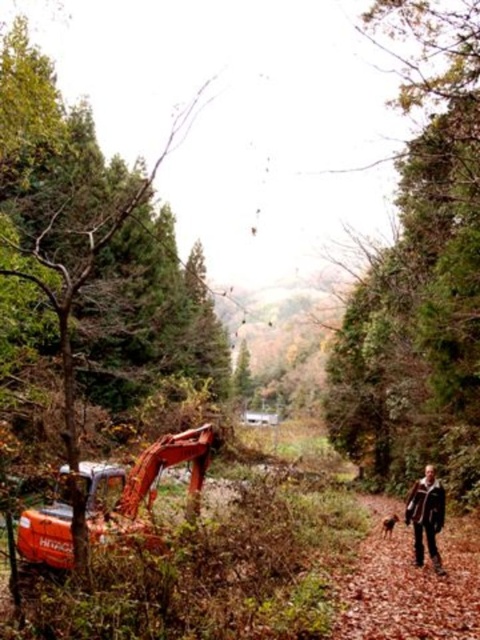
You are a hiker who has just arrived at this rural area. You see the brown leather jacket at lower right and a camera somewhere in the scene. How far apart are these two items?

The brown leather jacket at lower right and the camera are 40.30 feet apart.

You are a hiker who just arrived at the scene and want to retrieve your brown leather jacket at lower right and brown furry dog at lower right. If your reach is 12 feet, can you grab both items without moving from your current position?

The brown leather jacket at lower right is 13.24 feet away from the brown furry dog at lower right. Since your reach is only 12 feet, you cannot grab both items simultaneously without moving from your current position.

You are standing at the point marked by the coordinates point (425, 515) in the image. Looking around, you see a bright orange Hitachi excavator parked on the left side of a narrow dirt path and a person walking to the right of the excavator. What are you wearing?

The point (425, 515) corresponds to the brown leather jacket at lower right, so you are wearing a brown leather jacket.